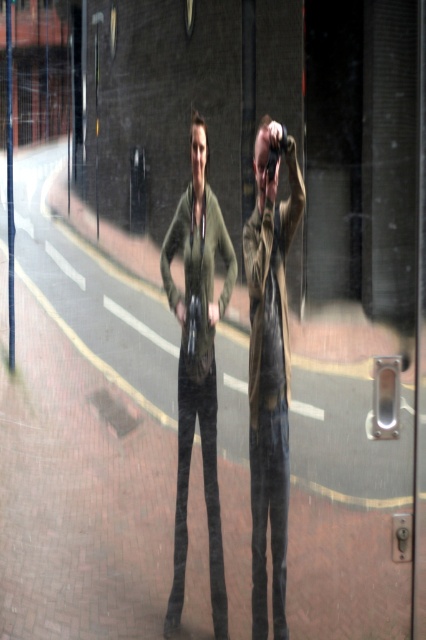
Looking at this image, in the scene where two people are reflected in a glass door, there is a leather jacket at center and an olive green fabric jacket at center. Which jacket is positioned to the right of the other?

The leather jacket at center is to the right of the olive green fabric jacket at center.

You are standing in front of a glass door that reflects two points. The first point is labeled as point (253, 458) and the second is point (178, 545). According to the reflection, which point is closer to you?

Point (178, 545) is closer to you because in the reflection, point (253, 458) is behind point (178, 545).